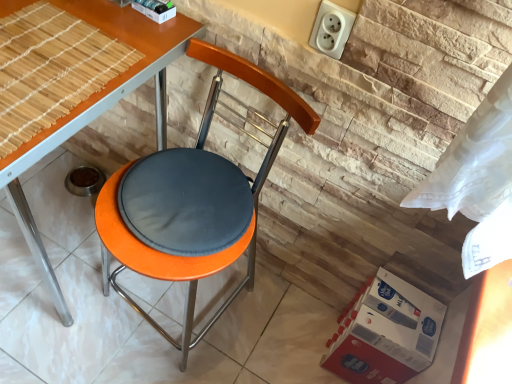
Question: From a real-world perspective, is bamboo mat at upper left positioned above or below orange matte stool at center?

Choices:
 (A) above
 (B) below

Answer: (A)

Question: Is bamboo mat at upper left to the left or to the right of orange matte stool at center in the image?

Choices:
 (A) right
 (B) left

Answer: (B)

Question: Considering the real-world distances, which object is farthest from the bamboo mat at upper left?

Choices:
 (A) red cardboard box at lower right
 (B) orange matte stool at center
 (C) orange matte table at center
 (D) orange fabric-covered chair at center
 (E) white plastic socket at upper right

Answer: (A)

Question: Based on their relative distances, which object is nearer to the white plastic socket at upper right?

Choices:
 (A) orange fabric-covered chair at center
 (B) bamboo mat at upper left
 (C) orange matte stool at center
 (D) red cardboard box at lower right
 (E) orange matte table at center

Answer: (E)